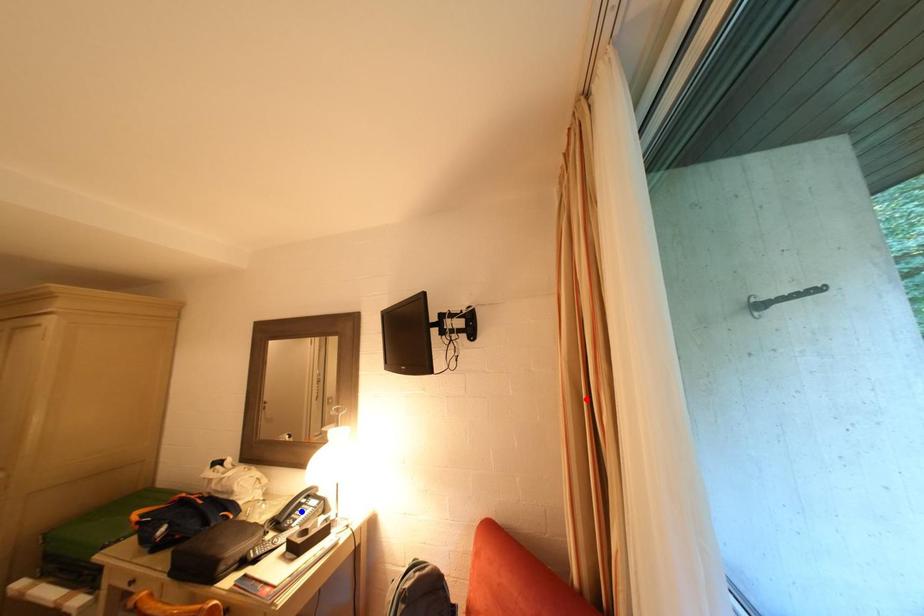
Question: In the image, two points are highlighted. Which point is nearer to the camera? Reply with the corresponding letter.

Choices:
 (A) blue point
 (B) red point

Answer: (B)